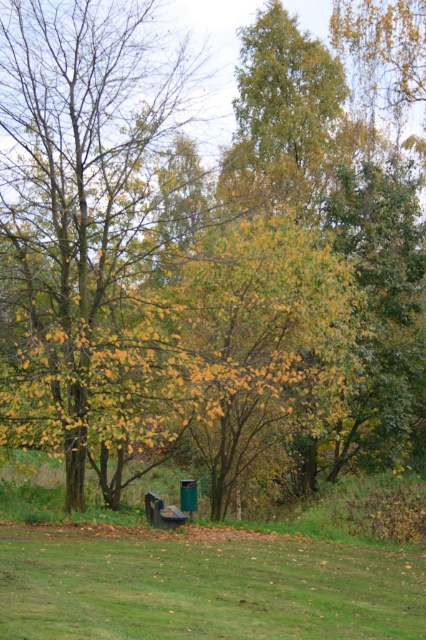
Can you confirm if green grassy field at lower center is shorter than wooden park bench at center?

Incorrect, green grassy field at lower center's height does not fall short of wooden park bench at center's.

Who is taller, green grassy field at lower center or wooden park bench at center?

green grassy field at lower center is taller.

This screenshot has height=640, width=426. I want to click on green grassy field at lower center, so click(x=206, y=588).

The height and width of the screenshot is (640, 426). What do you see at coordinates (279, 115) in the screenshot? I see `green leafy tree at upper center` at bounding box center [279, 115].

Can you confirm if green leafy tree at upper center is bigger than wooden park bench at center?

No, green leafy tree at upper center is not bigger than wooden park bench at center.

Between point (256, 131) and point (178, 509), which one is positioned behind?

The point (256, 131) is behind.

I want to click on green leafy tree at upper center, so click(279, 115).

Between green grassy field at lower center and green leafy tree at upper center, which one appears on the right side from the viewer's perspective?

From the viewer's perspective, green leafy tree at upper center appears more on the right side.

Does green grassy field at lower center appear on the left side of green leafy tree at upper center?

Correct, you'll find green grassy field at lower center to the left of green leafy tree at upper center.

Between point (403, 582) and point (321, 138), which one is positioned in front?

Point (403, 582) is in front.

Locate an element on the screen. This screenshot has width=426, height=640. green grassy field at lower center is located at coordinates (206, 588).